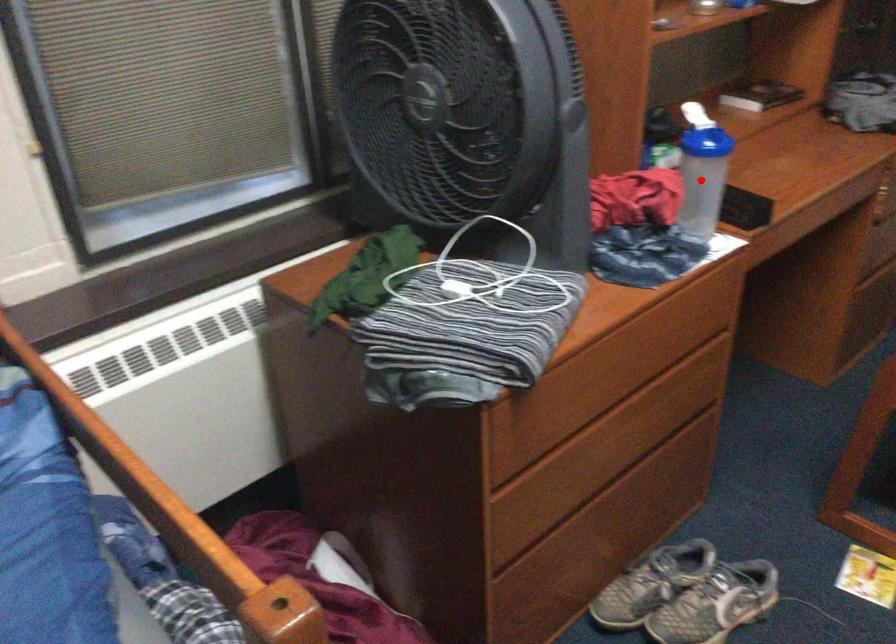
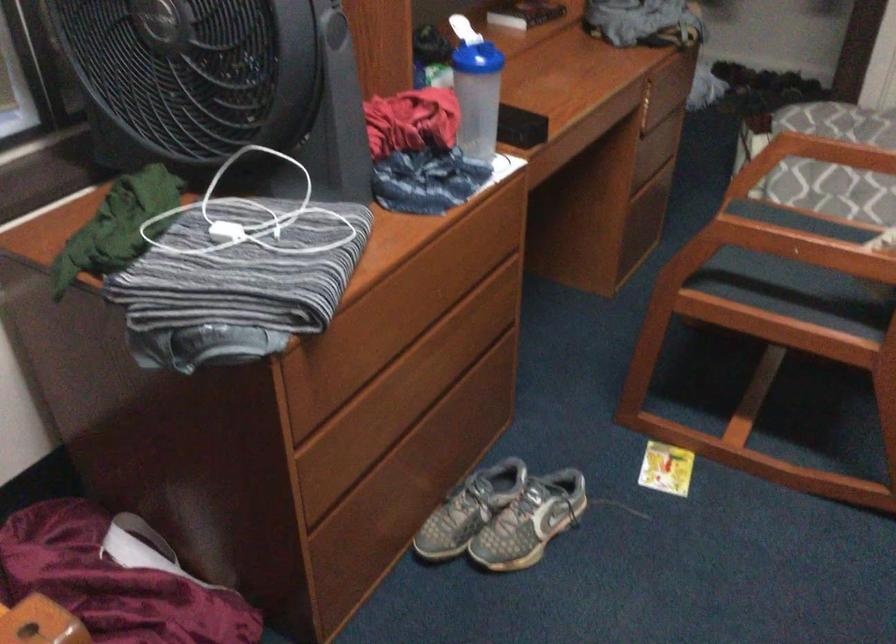
Locate, in the second image, the point that corresponds to the highlighted location in the first image.

(478, 97)